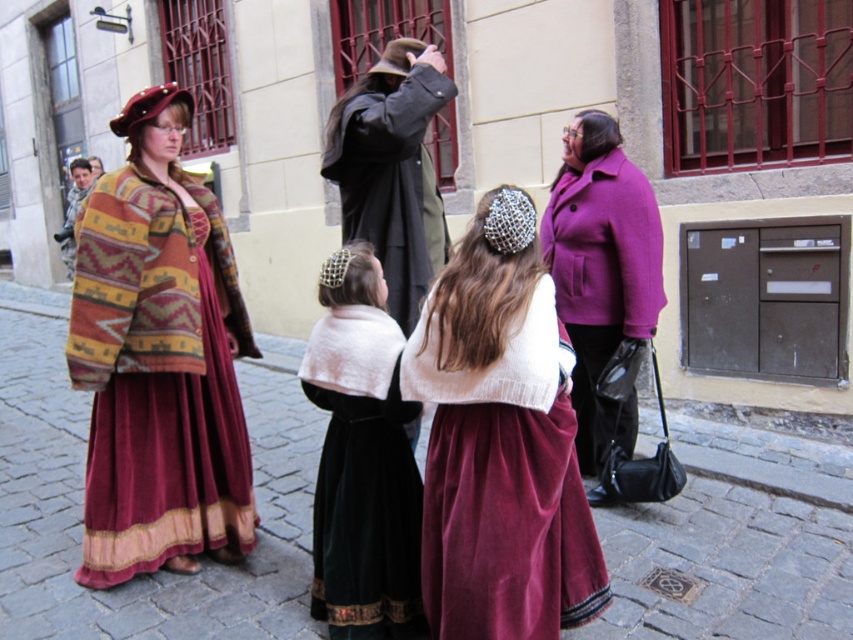
Question: Which is nearer to the purple wool coat at upper right?

Choices:
 (A) velvet black dress at center
 (B) velvet maroon skirt at center

Answer: (B)

Question: Which point appears farthest from the camera in this image?

Choices:
 (A) (397, 522)
 (B) (345, 106)
 (C) (653, 241)
 (D) (200, 448)

Answer: (C)

Question: Does knitted woolen shawl at left appear on the left side of purple wool coat at upper right?

Choices:
 (A) no
 (B) yes

Answer: (B)

Question: Does velvet black dress at center have a smaller size compared to purple woolen coat at right?

Choices:
 (A) no
 (B) yes

Answer: (A)

Question: Can you confirm if purple wool coat at upper right is bigger than purple woolen coat at right?

Choices:
 (A) no
 (B) yes

Answer: (B)

Question: Estimate the real-world distances between objects in this image. Which object is farther from the purple woolen coat at right?

Choices:
 (A) dark gray wool coat at center
 (B) velvet maroon skirt at center
 (C) velvet black dress at center
 (D) knitted woolen shawl at left

Answer: (D)